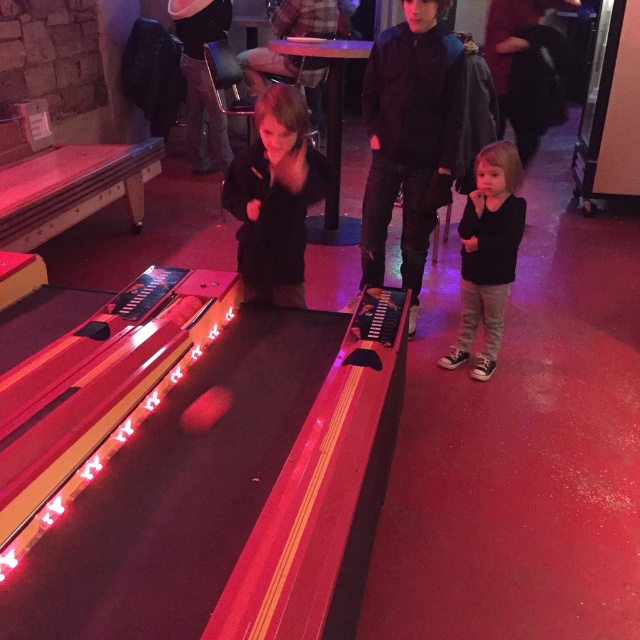
Consider the image. You are a photographer standing at the entrance of the bowling alley. You want to take a photo of the dark blue jacket at center and the black matte jacket at center so that both are clearly visible in the frame. Given that your camera has a minimum focus distance of 30 inches, will you be able to capture both jackets in the same photo without moving closer?

The dark blue jacket at center and the black matte jacket at center are 29.31 inches apart. Since the distance between them is less than the camera minimum focus distance of 30 inches, you can capture both jackets in the same photo without moving closer.

You are standing at the origin point of the coordinate system in this image. You want to locate the black matte jacket at center. In which direction should you move relative to your current position?

The black matte jacket at center is located at coordinate point 0.309 along the x axis and 0.431 along the y axis. Since you are at the origin, you should move towards the positive x and positive y direction to reach it.

You are a photographer trying to capture a group photo of the dark blue jacket at center and the black matte jacket at center. Which jacket should you focus on first if you want to include both in the frame without moving the camera?

You should focus on the dark blue jacket at center first because it is much taller than the black matte jacket at center, ensuring it fits within the frame.